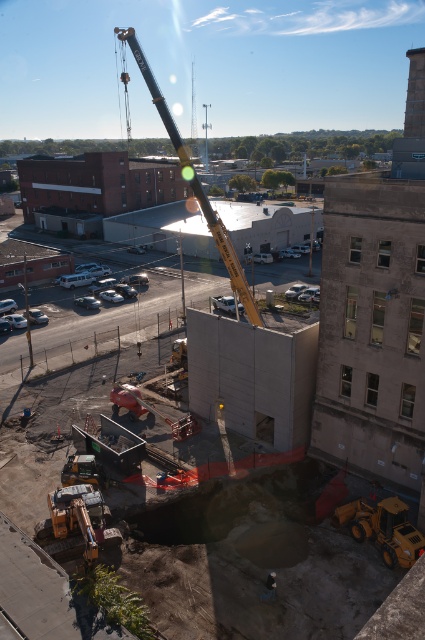
You are a safety inspector on an urban construction site. You need to ensure that the yellow metallic crane at upper center and the orange rubber crane at center are positioned at least 30 meters apart to avoid collision. Based on the scene description, can you confirm if they meet this safety requirement?

The distance between the yellow metallic crane at upper center and the orange rubber crane at center is 34.55 meters, which exceeds the 30 meters requirement. Therefore, they are positioned safely and meet the collision prevention criteria.

You are a drone operator trying to capture aerial footage of the construction site. You have two points marked on your map, point A at coordinates point (x=163, y=116) and point B at coordinates point (x=271, y=592). Which point is closer to your camera position?

Point A at coordinates point (x=163, y=116) is closer to the camera position because it is further to the camera than point B at coordinates point (x=271, y=592).